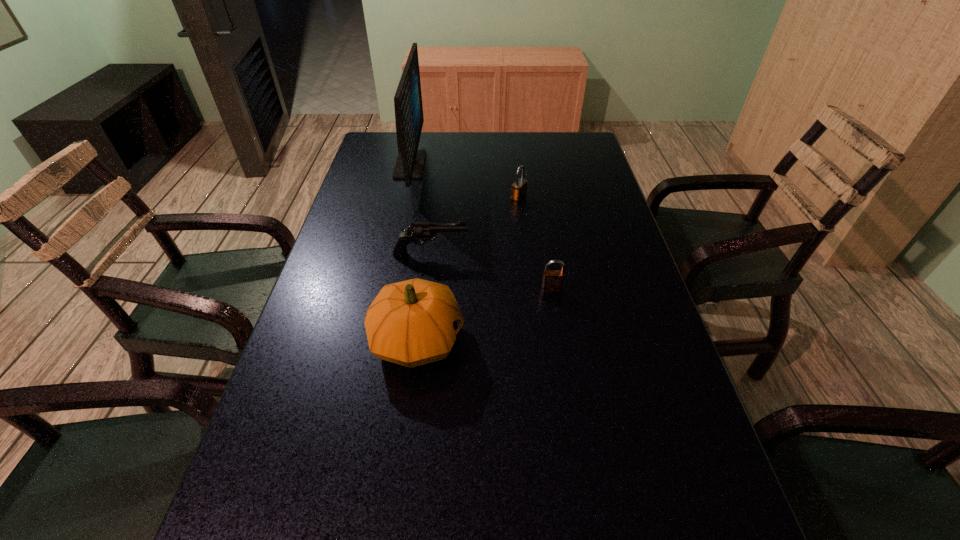
You are a GUI agent. You are given a task and a screenshot of the screen. Output one action in this format:
    pyautogui.click(x=<x>, y=<y>)
    Task: Click on the computer monitor
    The width and height of the screenshot is (960, 540).
    Given the screenshot: What is the action you would take?
    pyautogui.click(x=409, y=119)

At what (x,y) coordinates should I click in order to perform the action: click on the nearest object. Please return your answer as a coordinate pair (x, y). Looking at the image, I should click on (414, 322).

At what (x,y) coordinates should I click in order to perform the action: click on gourd. Please return your answer as a coordinate pair (x, y). This screenshot has width=960, height=540. Looking at the image, I should click on (414, 322).

Identify the location of the farther padlock. This screenshot has width=960, height=540. (519, 188).

The height and width of the screenshot is (540, 960). Identify the location of the second object from right to left. (519, 188).

Find the location of a particular element. gun is located at coordinates (419, 232).

The height and width of the screenshot is (540, 960). Find the location of `the nearer padlock`. the nearer padlock is located at coordinates (553, 280).

Identify the location of the fourth farthest object. (553, 280).

This screenshot has height=540, width=960. I want to click on vacant position located on the screen side of the computer monitor, so click(544, 165).

Locate an element on the screen. vacant space located on the side of the gourd with the carved face is located at coordinates (657, 340).